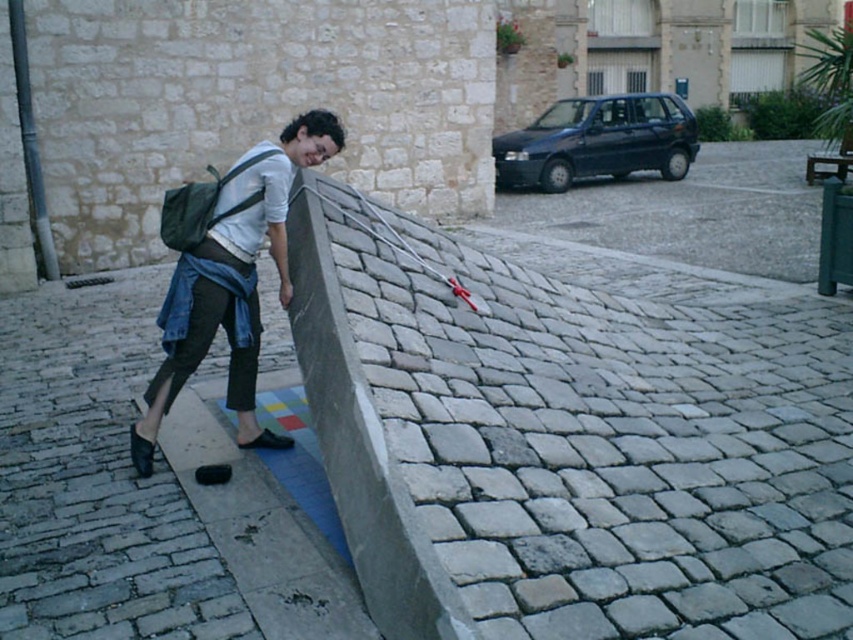
Question: Can you confirm if gray concrete ledge at center is thinner than denim jacket at left?

Choices:
 (A) no
 (B) yes

Answer: (A)

Question: Does gray concrete ledge at center have a larger size compared to denim jacket at left?

Choices:
 (A) no
 (B) yes

Answer: (B)

Question: Which point is closer to the camera?

Choices:
 (A) (160, 388)
 (B) (345, 401)

Answer: (B)

Question: Which of the following is the closest to the observer?

Choices:
 (A) gray concrete ledge at center
 (B) denim jacket at left

Answer: (A)

Question: Among these points, which one is farthest from the camera?

Choices:
 (A) (468, 372)
 (B) (186, 317)

Answer: (A)

Question: Is gray concrete ledge at center bigger than denim jacket at left?

Choices:
 (A) yes
 (B) no

Answer: (A)